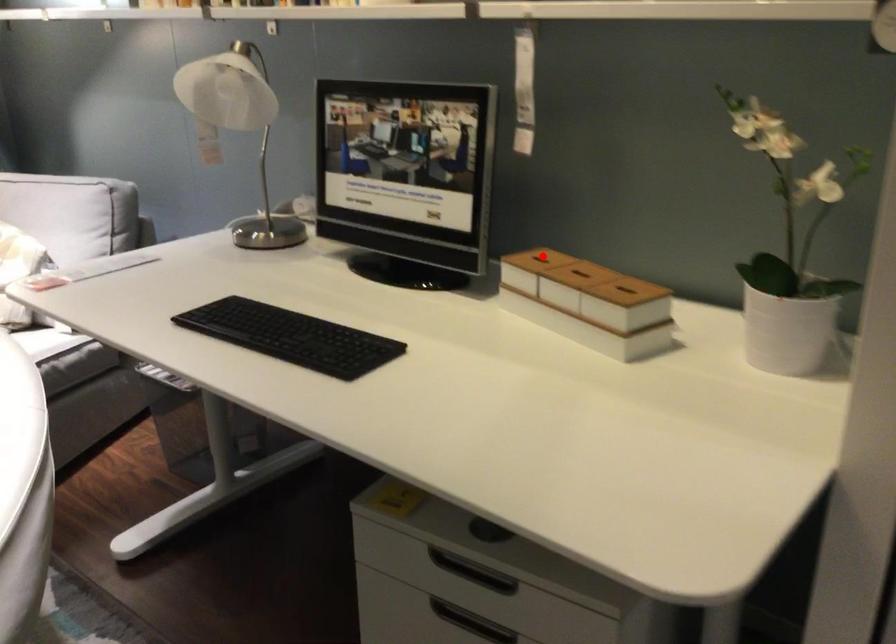
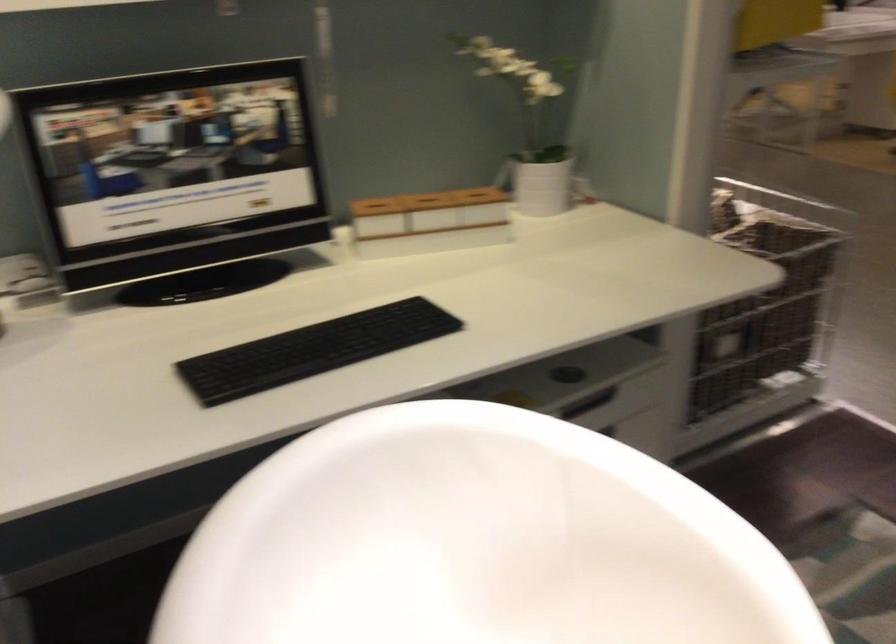
Locate, in the second image, the point that corresponds to the highlighted location in the first image.

(375, 204)